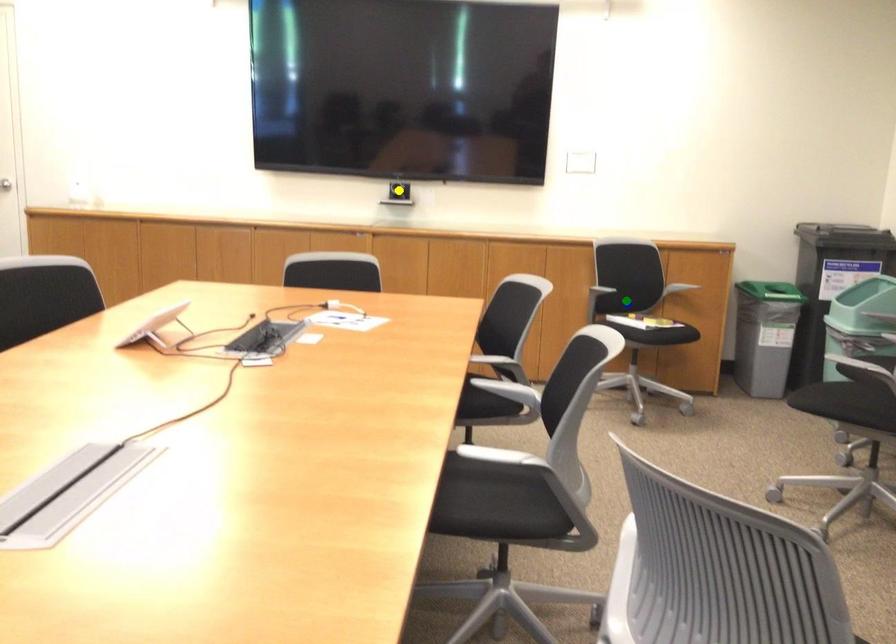
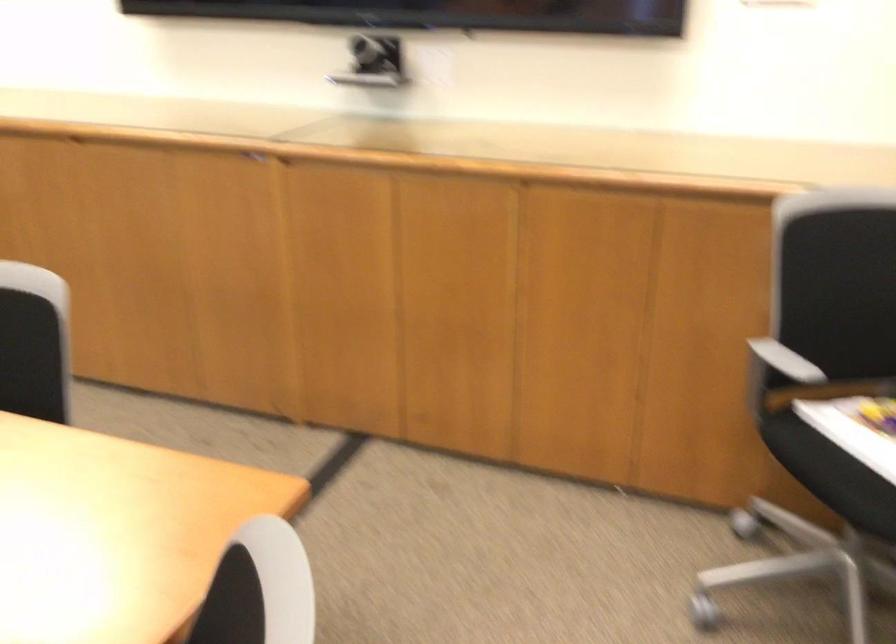
I am providing you with two images of the same scene from different viewpoints. Three points are marked in image1. Which point corresponds to a part or object that is occluded in image2?In image1, three points are marked. Which of them correspond to a part or object that is occluded in image2?Among the three points shown in image1, which one corresponds to a part or object that is no longer visible due to occlusion in image2?

Invisible in image2: yellow point.